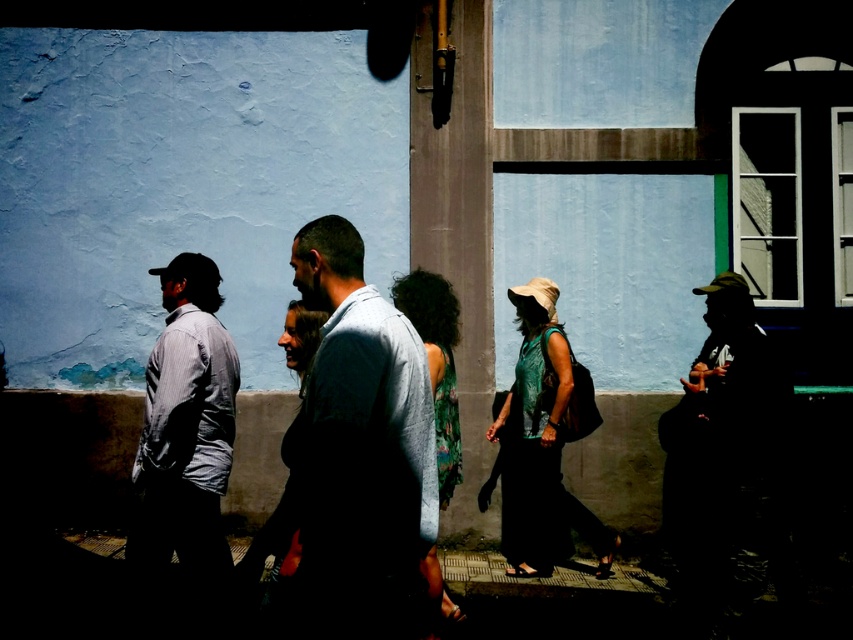
Which is more to the right, silhouette hat at right or light gray shirt at left?

Positioned to the right is silhouette hat at right.

Based on the photo, does silhouette hat at right have a smaller size compared to light gray shirt at left?

Actually, silhouette hat at right might be larger than light gray shirt at left.

What are the coordinates of `silhouette hat at right` in the screenshot? It's located at (723, 448).

Between green textured top at center and floral fabric dress at center, which one has more height?

Standing taller between the two is green textured top at center.

Is green textured top at center thinner than floral fabric dress at center?

In fact, green textured top at center might be wider than floral fabric dress at center.

Is point (550, 340) positioned behind point (398, 289)?

That is True.

Find the location of a particular element. The height and width of the screenshot is (640, 853). green textured top at center is located at coordinates (544, 442).

Consider the image. Between silhouette hat at right and floral fabric dress at center, which one is positioned higher?

floral fabric dress at center is higher up.

Identify the location of silhouette hat at right. (723, 448).

Where is `silhouette hat at right`? This screenshot has width=853, height=640. silhouette hat at right is located at coordinates (723, 448).